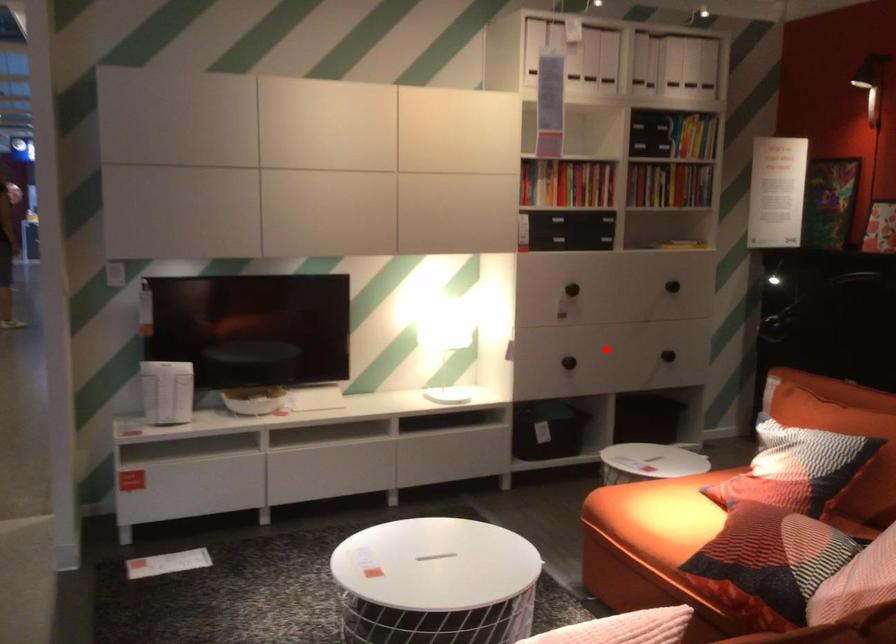
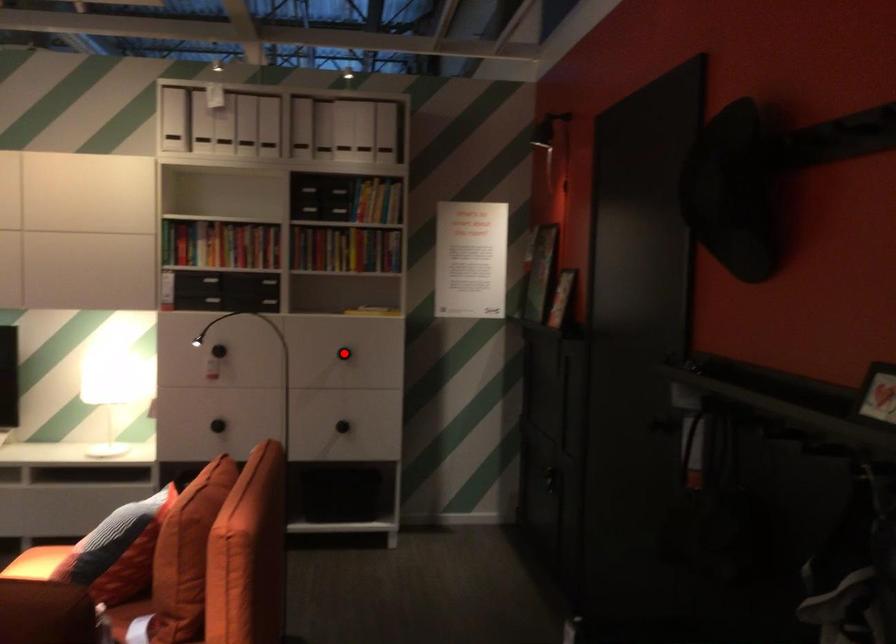
I am providing you with two images of the same scene from different viewpoints. A red point is marked on the first image and another point is marked on the second image. Are the points marked in image1 and image2 representing the same 3D position?

No